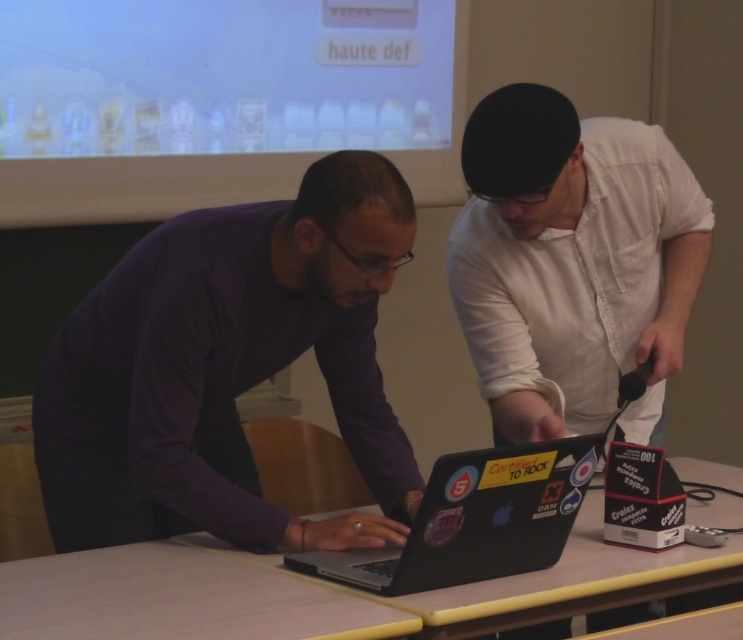
You are a delivery robot that needs to place a small package on the wooden table at center. The package is 7 inches long. Can you safely place it on the table without it overlapping the black matte laptop at center?

The distance between the wooden table at center and the black matte laptop at center is 6.74 inches. Since the package is 7 inches long, it would overlap the laptop if placed on the table. Therefore, you cannot safely place the package without overlapping.

You are standing in front of the wooden table at center and want to reach the black matte laptop at center. Which direction should you move to get to the laptop?

Since the wooden table at center is to the right of the black matte laptop at center, you should move to your left to reach the laptop.

You are a delivery person who needs to place a small package on the purple matte sweater at center or the wooden table at center. Which surface can accommodate the package without overlapping the other object?

The wooden table at center can accommodate the package without overlapping the purple matte sweater at center because the purple matte sweater at center occupies less space than the wooden table at center.